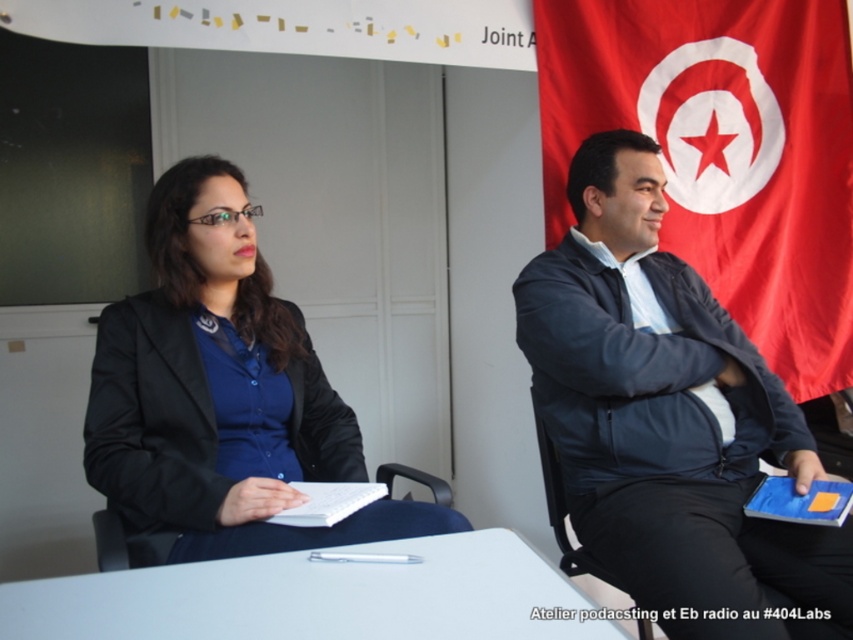
Based on the scene description, can you determine which object is positioned to the right of the other between the dark blue jacket at right and the matte black blazer at center?

The dark blue jacket at right is positioned to the right of the matte black blazer at center.

You are standing in front of the table where the woman in dark blazer and blue shirt and the man in dark jacket and white collared shirt are seated. You want to place a small gift on the table exactly at point (334, 474). The gift requires a space of 3 feet in front of it to be clear. Is there enough space in front of the point to place the gift?

The point (334, 474) is 5.23 feet away from the camera. Since the gift requires 3 feet of clear space in front of it, and the distance from the camera to the point is greater than 3 feet, there is sufficient space to place the gift there.